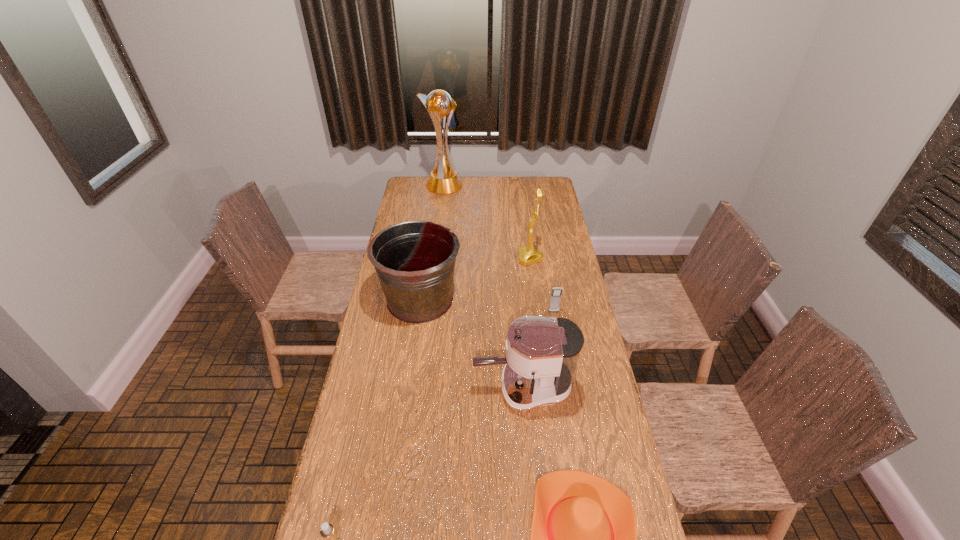
In order to click on unoccupied position between the coffee maker and the bucket in this screenshot , I will do click(471, 344).

This screenshot has width=960, height=540. In order to click on object that stands as the closest to the cellular telephone in this screenshot , I will do `click(542, 353)`.

Locate an element on the screen. This screenshot has width=960, height=540. object that is the fourth closest to the cowboy hat is located at coordinates (555, 298).

Find the location of a particular element. Image resolution: width=960 pixels, height=540 pixels. vacant space that satisfies the following two spatial constraints: 1. on the front-facing side of the cellular telephone; 2. on the front-facing side of the coffee maker is located at coordinates (567, 388).